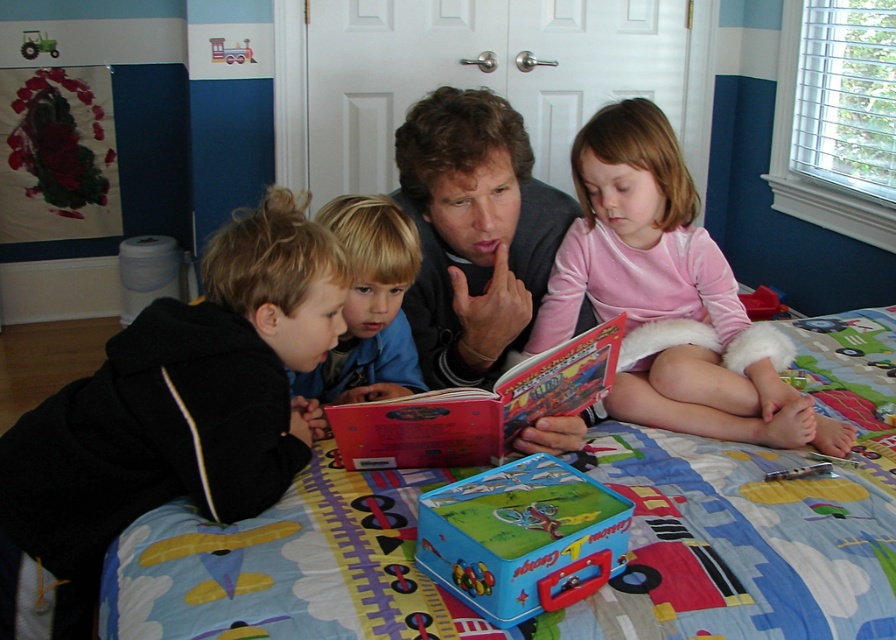
Can you confirm if printed fabric quilt at center is positioned to the left of blue cotton shirt at center?

Incorrect, printed fabric quilt at center is not on the left side of blue cotton shirt at center.

Which is below, printed fabric quilt at center or blue cotton shirt at center?

Positioned lower is printed fabric quilt at center.

Find the location of a particular element. printed fabric quilt at center is located at coordinates (602, 586).

Who is more distant from viewer, (533, 196) or (320, 396)?

The point (533, 196) is behind.

Does matte black sweater at center have a lesser height compared to blue cotton shirt at center?

No.

Locate an element on the screen. The image size is (896, 640). matte black sweater at center is located at coordinates (474, 232).

Does pink fleece skirt at center come in front of hardcover book at center?

No, pink fleece skirt at center is further to the viewer.

Between point (702, 424) and point (616, 330), which one is positioned behind?

The point (702, 424) is more distant.

Is point (688, 280) more distant than point (444, 396)?

Yes, it is behind point (444, 396).

The width and height of the screenshot is (896, 640). In order to click on pink fleece skirt at center in this screenshot , I will do `click(666, 292)`.